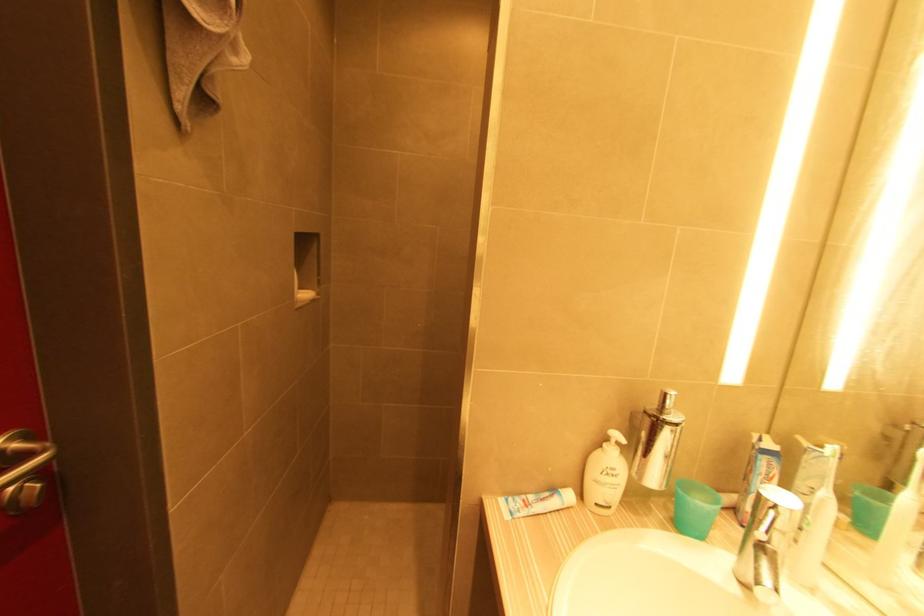
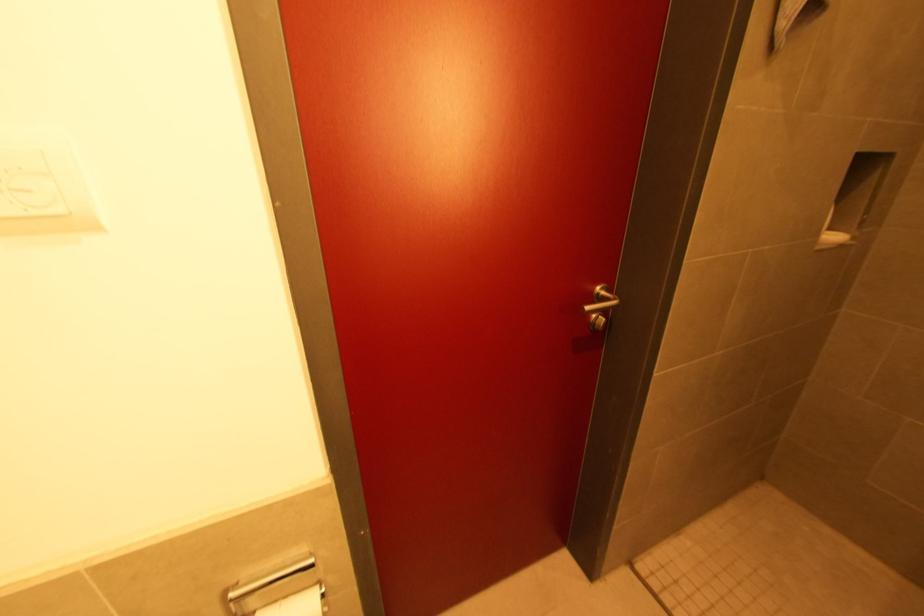
In the second image, find the point that corresponds to (309,296) in the first image.

(833, 238)